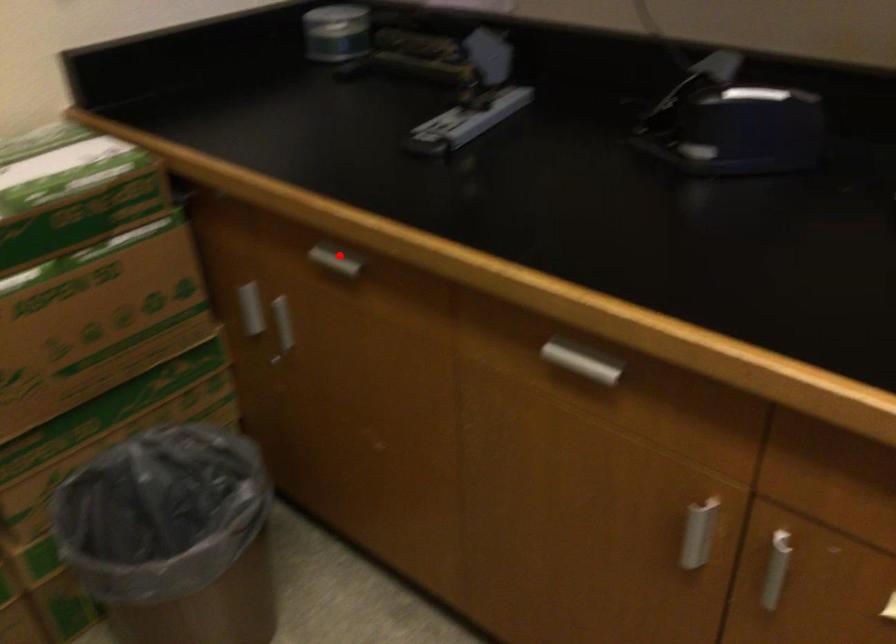
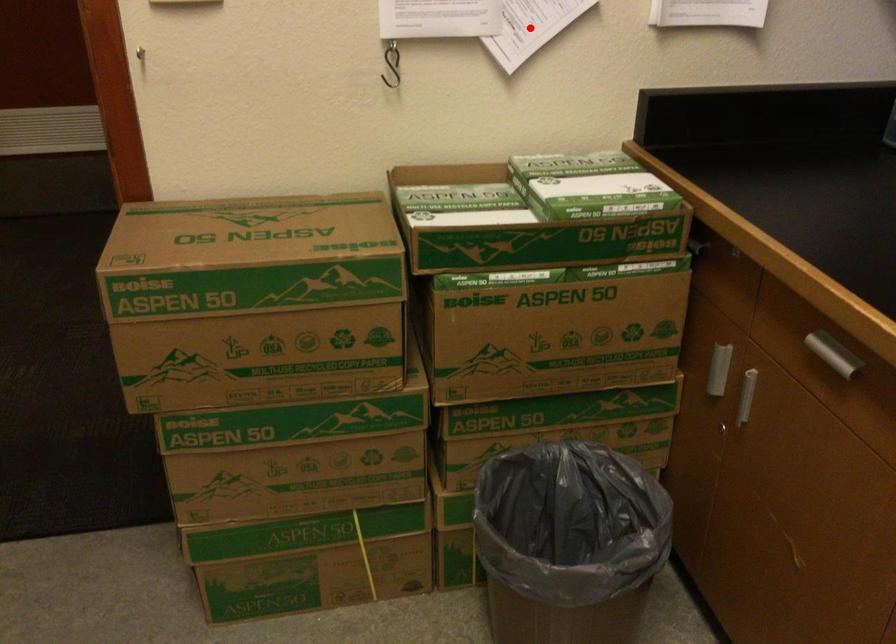
I am providing you with two images of the same scene from different viewpoints. A red point is marked on the first image and another point is marked on the second image. Does the point marked in image1 correspond to the same location as the one in image2?

No